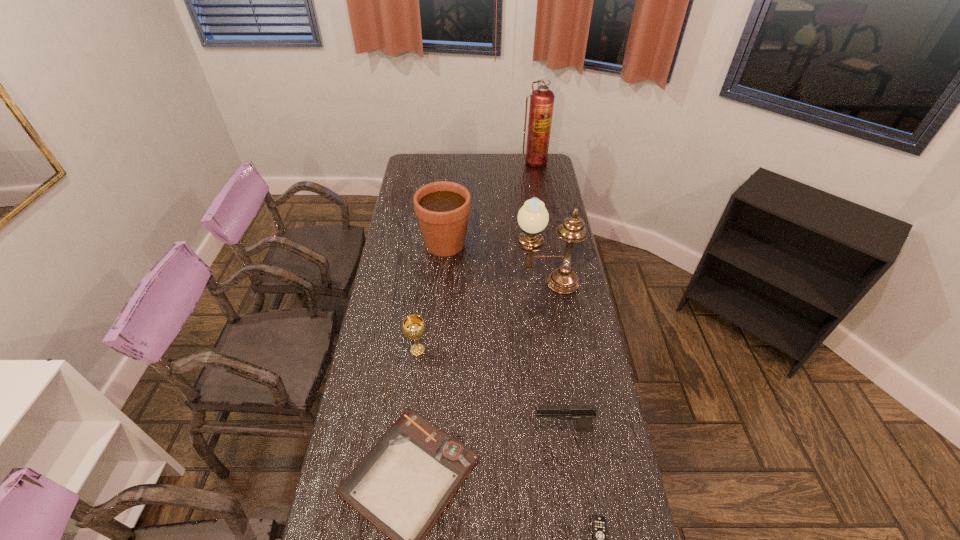
Where is `vacant space situated on the right of the fourth tallest object`? This screenshot has height=540, width=960. vacant space situated on the right of the fourth tallest object is located at coordinates (491, 350).

I want to click on free space located aim along the barrel of the pistol, so click(493, 429).

Find the location of a particular element. free space located aim along the barrel of the pistol is located at coordinates (444, 429).

Identify the location of vacant space situated 0.260m aim along the barrel of the pistol. (446, 429).

This screenshot has width=960, height=540. What are the coordinates of `object located in the far edge section of the desktop` in the screenshot? It's located at (542, 99).

Where is `flowerpot at the left edge`? This screenshot has width=960, height=540. flowerpot at the left edge is located at coordinates (442, 208).

In order to click on chalice that is at the left edge in this screenshot , I will do `click(414, 327)`.

Image resolution: width=960 pixels, height=540 pixels. I want to click on fire extinguisher located at the right edge, so click(542, 99).

Find the location of a particular element. Image resolution: width=960 pixels, height=540 pixels. oil lamp present at the right edge is located at coordinates (533, 217).

This screenshot has width=960, height=540. Find the location of `pistol that is at the right edge`. pistol that is at the right edge is located at coordinates (583, 414).